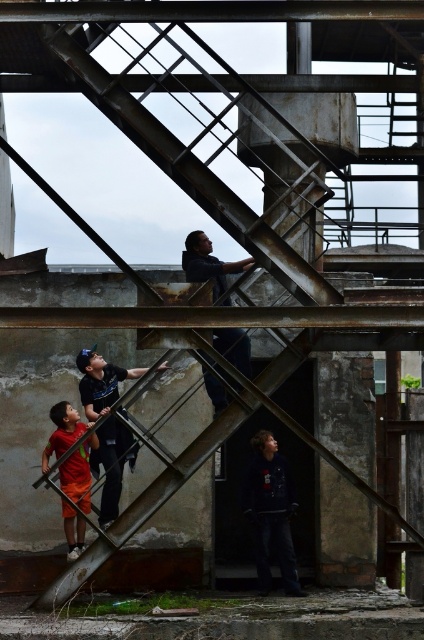
Who is taller, dark blue jacket at lower center or dark blue shirt at center?

dark blue jacket at lower center

Locate an element on the screen. This screenshot has height=640, width=424. dark blue jacket at lower center is located at coordinates (270, 513).

Who is shorter, dark blue jacket at lower center or orange cotton shorts at lower left?

Standing shorter between the two is orange cotton shorts at lower left.

Can you confirm if dark blue jacket at lower center is shorter than orange cotton shorts at lower left?

No, dark blue jacket at lower center is not shorter than orange cotton shorts at lower left.

Between point (292, 582) and point (69, 493), which one is positioned in front?

Positioned in front is point (69, 493).

Locate an element on the screen. This screenshot has width=424, height=640. dark blue jacket at lower center is located at coordinates (270, 513).

Does orange cotton shorts at lower left appear under dark blue shirt at center?

Correct, orange cotton shorts at lower left is located below dark blue shirt at center.

Who is more distant from viewer, [53,440] or [228,298]?

The point [228,298] is behind.

In the scene shown: Who is more distant from viewer, (58, 452) or (237, 330)?

Positioned behind is point (58, 452).

What are the coordinates of `orange cotton shorts at lower left` in the screenshot? It's located at (78, 474).